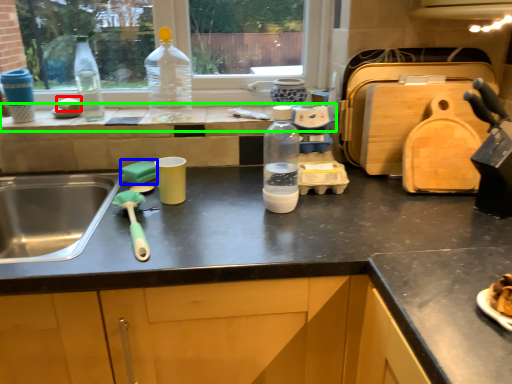
Question: Which object is the closest to the food (highlighted by a red box)? Choose among these: food (highlighted by a blue box) or window sill (highlighted by a green box).

Choices:
 (A) food
 (B) window sill

Answer: (B)